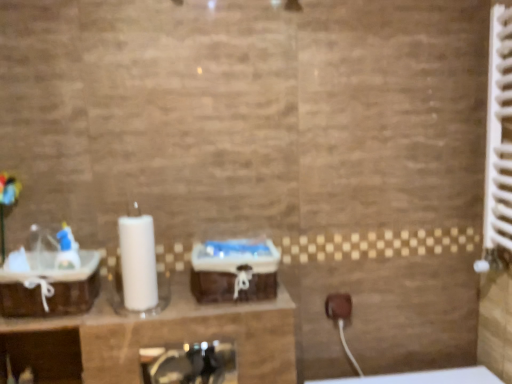
Question: From the image's perspective, is white plastic radiator at right located above or below brown woven basket at left?

Choices:
 (A) below
 (B) above

Answer: (B)

Question: From a real-world perspective, is white plastic radiator at right positioned above or below brown woven basket at left?

Choices:
 (A) below
 (B) above

Answer: (B)

Question: Considering the positions of white plastic radiator at right and brown woven basket at left in the image, is white plastic radiator at right taller or shorter than brown woven basket at left?

Choices:
 (A) short
 (B) tall

Answer: (B)

Question: Is brown woven basket at left in front of or behind white plastic radiator at right in the image?

Choices:
 (A) behind
 (B) front

Answer: (A)

Question: In terms of size, does brown woven basket at left appear bigger or smaller than white plastic radiator at right?

Choices:
 (A) small
 (B) big

Answer: (A)

Question: Visually, is brown woven basket at left positioned to the left or to the right of white plastic radiator at right?

Choices:
 (A) right
 (B) left

Answer: (B)

Question: From the image's perspective, is brown woven basket at left above or below white plastic radiator at right?

Choices:
 (A) above
 (B) below

Answer: (B)